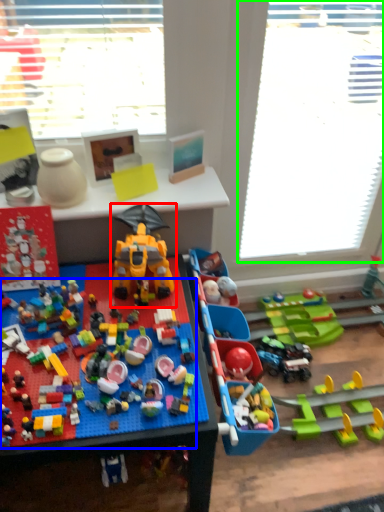
Question: Based on their relative distances, which object is nearer to toy (highlighted by a red box)? Choose from toy (highlighted by a blue box) and window screen (highlighted by a green box).

Choices:
 (A) toy
 (B) window screen

Answer: (A)